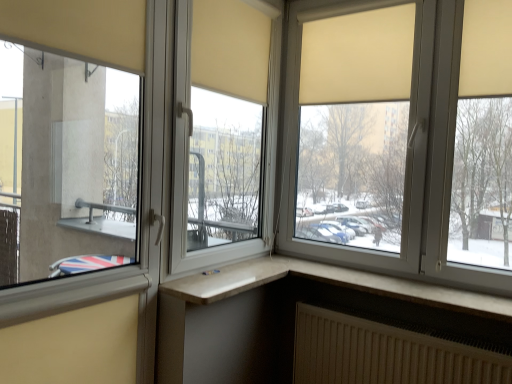
Question: In the image, is white plastic window at lower right, marked as the third window in a left-to-right arrangement, on the left side or the right side of matte glass window at left, arranged as the third window when viewed from the right?

Choices:
 (A) right
 (B) left

Answer: (A)

Question: Considering the positions of white plastic window at lower right, marked as the third window in a left-to-right arrangement, and matte glass window at left, the first window when ordered from left to right, in the image, is white plastic window at lower right, marked as the third window in a left-to-right arrangement, taller or shorter than matte glass window at left, the first window when ordered from left to right,?

Choices:
 (A) short
 (B) tall

Answer: (A)

Question: Which of these objects is positioned closest to the matte glass window at left, the first window when ordered from left to right?

Choices:
 (A) matte beige roller blind at upper right, placed as the 2th window when sorted from right to left
 (B) white plastic window at lower right, marked as the third window in a left-to-right arrangement
 (C) white textured radiator at lower right

Answer: (A)

Question: Based on their relative distances, which object is farther from the matte beige roller blind at upper right, which ranks as the 2th window in left-to-right order?

Choices:
 (A) matte glass window at left, arranged as the third window when viewed from the right
 (B) white plastic window at lower right, the 1th window viewed from the right
 (C) white textured radiator at lower right

Answer: (A)